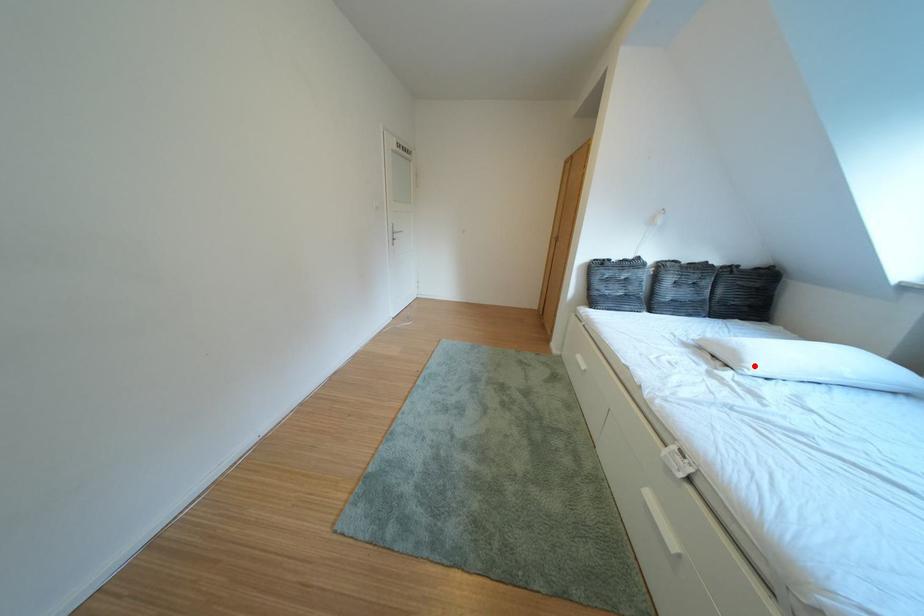
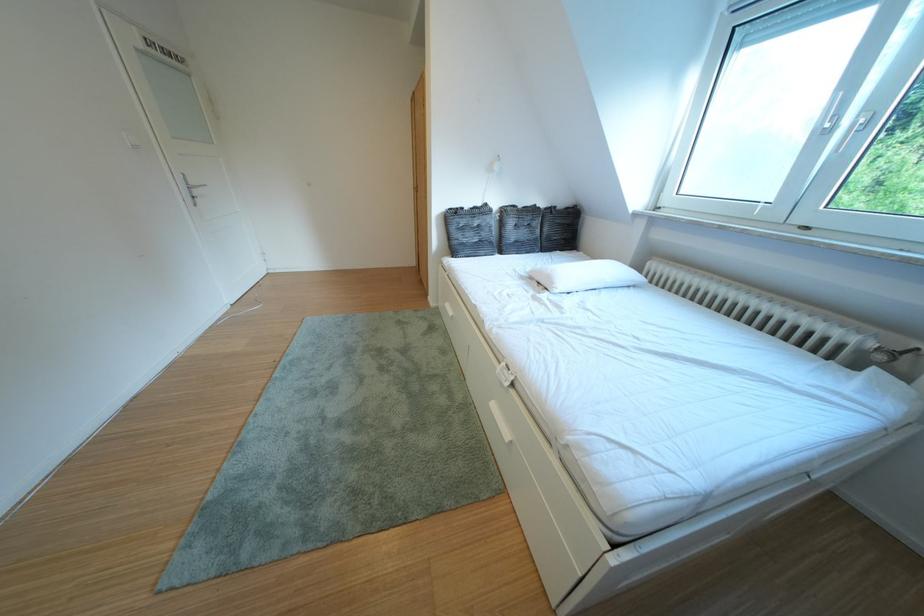
Question: I am providing you with two images of the same scene from different viewpoints. A red point is shown in image1. For the corresponding object point in image2, is it positioned nearer or farther from the camera?

Choices:
 (A) Nearer
 (B) Farther

Answer: (A)